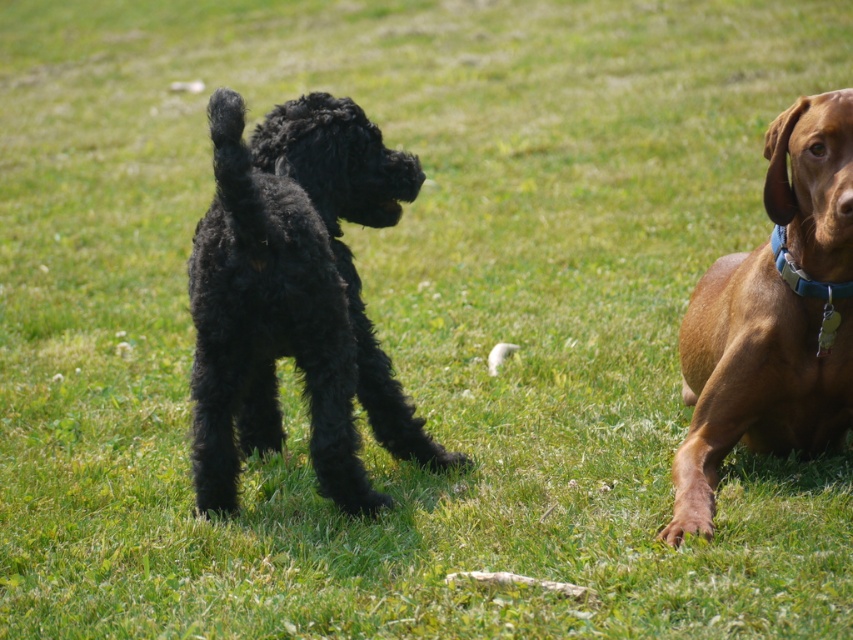
You are a photographer trying to capture a group photo of the black fluffy dog at center and the blue fabric collar at right. If your camera has a depth of field that can focus on objects within a 1.5 meters range, will both subjects be in focus?

The black fluffy dog at center is 1.57 meters from the blue fabric collar at right. Since the distance between them exceeds the camera sensor range of 1.5 meters, both subjects cannot be in focus simultaneously.

Based on the photo, you are a photographer setting up a tripod to take a portrait of the brown smooth dog at right and the blue fabric collar at right. Since you want to capture both subjects clearly, which one should you focus on first to ensure proper depth of field?

The brown smooth dog at right is much taller than the blue fabric collar at right, so you should focus on the brown smooth dog at right first to ensure proper depth of field.

You are a photographer trying to capture a clear shot of the brown smooth dog at right and the blue fabric collar at right. Which object is positioned closer to the camera?

The brown smooth dog at right is closer to the viewer than the blue fabric collar at right, so the brown smooth dog at right will appear clearer in the photo.